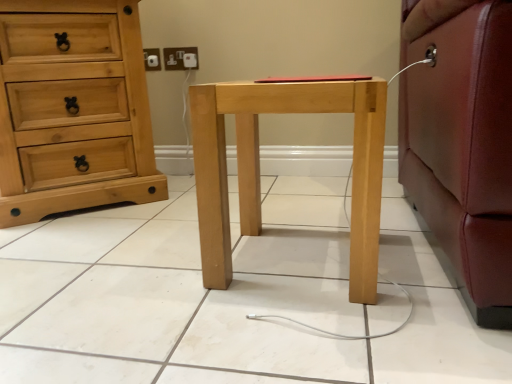
Find the location of a particular element. vacant space in front of natural wood nightstand at center is located at coordinates 310,335.